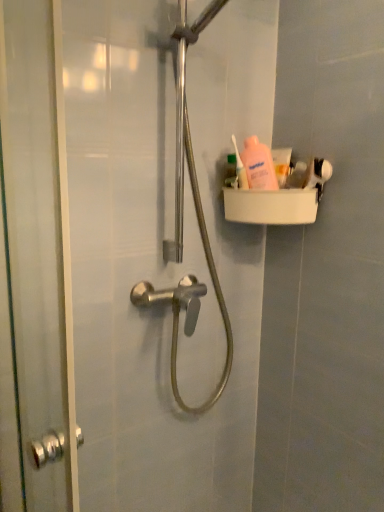
I want to click on white matte toothpaste at upper right, so click(282, 164).

Measure the distance between transparent glass screen door at left and camera.

transparent glass screen door at left is 47.94 centimeters from camera.

Locate an element on the screen. This screenshot has width=384, height=512. pink plastic bottle at upper right, the 2th toiletry from the right is located at coordinates (240, 168).

Describe the element at coordinates (297, 176) in the screenshot. This screenshot has width=384, height=512. I see `pink matte lotion at upper right, acting as the 1th toiletry starting from the right` at that location.

Identify the location of white matte toothpaste at upper right. (282, 164).

Can we say white matte toothpaste at upper right lies outside pink matte lotion at upper right, which is the 2th toiletry in left-to-right order?

Yes.

Who is shorter, white matte toothpaste at upper right or pink matte lotion at upper right, which is the 2th toiletry in left-to-right order?

pink matte lotion at upper right, which is the 2th toiletry in left-to-right order, is shorter.

Which object is further away from the camera, white matte toothpaste at upper right or pink matte lotion at upper right, acting as the 1th toiletry starting from the right?

white matte toothpaste at upper right is more distant.

Can you see white matte toothpaste at upper right touching pink matte lotion at upper right, acting as the 1th toiletry starting from the right?

Yes, the surface of white matte toothpaste at upper right is in contact with pink matte lotion at upper right, acting as the 1th toiletry starting from the right.

From the image's perspective, would you say transparent glass screen door at left is shown under white matte toothpaste at upper right?

Correct, transparent glass screen door at left appears lower than white matte toothpaste at upper right in the image.

Between transparent glass screen door at left and white matte toothpaste at upper right, which one is positioned in front?

Positioned in front is transparent glass screen door at left.

Between transparent glass screen door at left and white matte toothpaste at upper right, which one has larger size?

transparent glass screen door at left.

Considering the relative positions of transparent glass screen door at left and white matte toothpaste at upper right in the image provided, is transparent glass screen door at left to the right of white matte toothpaste at upper right from the viewer's perspective?

No, transparent glass screen door at left is not to the right of white matte toothpaste at upper right.

What's the angular difference between pink matte lotion at upper right, acting as the 1th toiletry starting from the right, and transparent glass screen door at left's facing directions?

The angle between the facing direction of pink matte lotion at upper right, acting as the 1th toiletry starting from the right, and the facing direction of transparent glass screen door at left is 41.8 degrees.

From their relative heights in the image, would you say pink matte lotion at upper right, which is the 2th toiletry in left-to-right order, is taller or shorter than transparent glass screen door at left?

Considering their sizes, pink matte lotion at upper right, which is the 2th toiletry in left-to-right order, has less height than transparent glass screen door at left.

In terms of size, does pink matte lotion at upper right, which is the 2th toiletry in left-to-right order, appear bigger or smaller than transparent glass screen door at left?

Considering their sizes, pink matte lotion at upper right, which is the 2th toiletry in left-to-right order, takes up less space than transparent glass screen door at left.

Considering the positions of points (296, 169) and (17, 437), is point (296, 169) farther from camera compared to point (17, 437)?

Yes.

Could you tell me if white matte toothpaste at upper right is turned towards pink plastic bottle at upper right, which is counted as the 1th toiletry, starting from the left?

No, white matte toothpaste at upper right does not turn towards pink plastic bottle at upper right, which is counted as the 1th toiletry, starting from the left.

From a real-world perspective, is white matte toothpaste at upper right located higher than pink plastic bottle at upper right, which is counted as the 1th toiletry, starting from the left?

No, from a real-world perspective, white matte toothpaste at upper right is not over pink plastic bottle at upper right, which is counted as the 1th toiletry, starting from the left

From their relative heights in the image, would you say pink matte lotion at upper right, which is the 2th toiletry in left-to-right order, is taller or shorter than white matte toothpaste at upper right?

Clearly, pink matte lotion at upper right, which is the 2th toiletry in left-to-right order, is shorter compared to white matte toothpaste at upper right.

Is pink matte lotion at upper right, which is the 2th toiletry in left-to-right order, bigger than white matte toothpaste at upper right?

No, pink matte lotion at upper right, which is the 2th toiletry in left-to-right order, is not bigger than white matte toothpaste at upper right.

The height and width of the screenshot is (512, 384). I want to click on toothpaste lying above the pink matte lotion at upper right, which is the 2th toiletry in left-to-right order (from the image's perspective), so click(x=282, y=164).

Considering the relative positions of pink matte lotion at upper right, acting as the 1th toiletry starting from the right, and pink plastic bottle at upper right, the 2th toiletry from the right, in the image provided, is pink matte lotion at upper right, acting as the 1th toiletry starting from the right, behind pink plastic bottle at upper right, the 2th toiletry from the right,?

Yes.

Looking at the image, does pink matte lotion at upper right, acting as the 1th toiletry starting from the right, seem bigger or smaller compared to pink plastic bottle at upper right, which is counted as the 1th toiletry, starting from the left?

pink matte lotion at upper right, acting as the 1th toiletry starting from the right, is bigger than pink plastic bottle at upper right, which is counted as the 1th toiletry, starting from the left.

Consider the image. From the image's perspective, is pink plastic bottle at upper right, the 2th toiletry from the right, on pink matte lotion at upper right, which is the 2th toiletry in left-to-right order?

Yes, from the image's perspective, pink plastic bottle at upper right, the 2th toiletry from the right, is above pink matte lotion at upper right, which is the 2th toiletry in left-to-right order.

Considering the positions of objects pink plastic bottle at upper right, which is counted as the 1th toiletry, starting from the left, and pink matte lotion at upper right, acting as the 1th toiletry starting from the right, in the image provided, who is more to the left, pink plastic bottle at upper right, which is counted as the 1th toiletry, starting from the left, or pink matte lotion at upper right, acting as the 1th toiletry starting from the right,?

From the viewer's perspective, pink plastic bottle at upper right, which is counted as the 1th toiletry, starting from the left, appears more on the left side.

Which point is more forward, (237, 153) or (293, 178)?

Positioned in front is point (293, 178).

Looking at their sizes, would you say pink plastic bottle at upper right, which is counted as the 1th toiletry, starting from the left, is wider or thinner than pink matte lotion at upper right, which is the 2th toiletry in left-to-right order?

Clearly, pink plastic bottle at upper right, which is counted as the 1th toiletry, starting from the left, has less width compared to pink matte lotion at upper right, which is the 2th toiletry in left-to-right order.

Identify the location of toothpaste behind the pink matte lotion at upper right, which is the 2th toiletry in left-to-right order. tap(282, 164).

Locate an element on the screen. toothpaste that is above the transparent glass screen door at left (from a real-world perspective) is located at coordinates (282, 164).

Estimate the real-world distances between objects in this image. Which object is further from pink matte lotion at upper right, acting as the 1th toiletry starting from the right, white matte toothpaste at upper right or pink plastic bottle at upper right, the 2th toiletry from the right?

The object further to pink matte lotion at upper right, acting as the 1th toiletry starting from the right, is pink plastic bottle at upper right, the 2th toiletry from the right.

Based on their spatial positions, is white matte toothpaste at upper right or pink plastic bottle at upper right, which is counted as the 1th toiletry, starting from the left, further from transparent glass screen door at left?

Among the two, white matte toothpaste at upper right is located further to transparent glass screen door at left.

Based on their spatial positions, is pink plastic bottle at upper right, the 2th toiletry from the right, or pink matte lotion at upper right, which is the 2th toiletry in left-to-right order, further from white matte toothpaste at upper right?

pink plastic bottle at upper right, the 2th toiletry from the right, lies further to white matte toothpaste at upper right than the other object.

From the picture: From the image, which object appears to be nearer to white matte toothpaste at upper right, pink matte lotion at upper right, acting as the 1th toiletry starting from the right, or pink plastic bottle at upper right, which is counted as the 1th toiletry, starting from the left?

Among the two, pink matte lotion at upper right, acting as the 1th toiletry starting from the right, is located nearer to white matte toothpaste at upper right.

Estimate the real-world distances between objects in this image. Which object is further from pink matte lotion at upper right, acting as the 1th toiletry starting from the right, pink plastic bottle at upper right, the 2th toiletry from the right, or transparent glass screen door at left?

transparent glass screen door at left is further to pink matte lotion at upper right, acting as the 1th toiletry starting from the right.

When comparing their distances from pink plastic bottle at upper right, which is counted as the 1th toiletry, starting from the left, does pink matte lotion at upper right, acting as the 1th toiletry starting from the right, or white matte toothpaste at upper right seem closer?

Based on the image, white matte toothpaste at upper right appears to be nearer to pink plastic bottle at upper right, which is counted as the 1th toiletry, starting from the left.

When comparing their distances from transparent glass screen door at left, does white matte toothpaste at upper right or pink matte lotion at upper right, which is the 2th toiletry in left-to-right order, seem closer?

white matte toothpaste at upper right.

Estimate the real-world distances between objects in this image. Which object is closer to pink plastic bottle at upper right, which is counted as the 1th toiletry, starting from the left, white matte toothpaste at upper right or pink matte lotion at upper right, acting as the 1th toiletry starting from the right?

Among the two, white matte toothpaste at upper right is located nearer to pink plastic bottle at upper right, which is counted as the 1th toiletry, starting from the left.

Locate an element on the screen. Image resolution: width=384 pixels, height=512 pixels. toothpaste between pink plastic bottle at upper right, which is counted as the 1th toiletry, starting from the left, and pink matte lotion at upper right, which is the 2th toiletry in left-to-right order is located at coordinates (282, 164).

Identify the location of toiletry between transparent glass screen door at left and pink matte lotion at upper right, acting as the 1th toiletry starting from the right, from front to back. (240, 168).